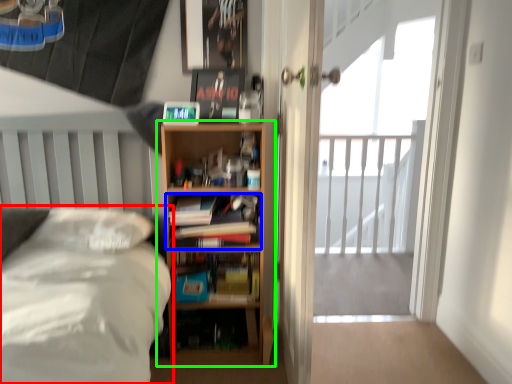
Question: Which object is positioned closest to bed (highlighted by a red box)? Select from book (highlighted by a blue box) and bookcase (highlighted by a green box).

Choices:
 (A) book
 (B) bookcase

Answer: (A)